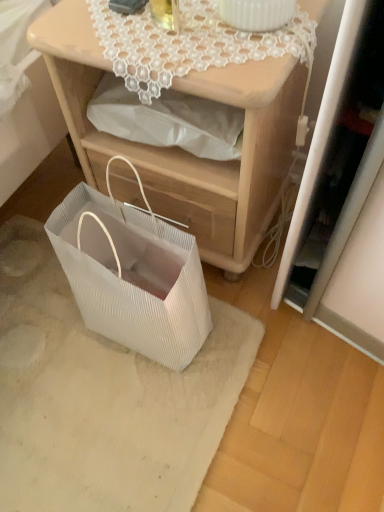
I want to click on free space above white lace doily at upper center (from a real-world perspective), so click(x=202, y=29).